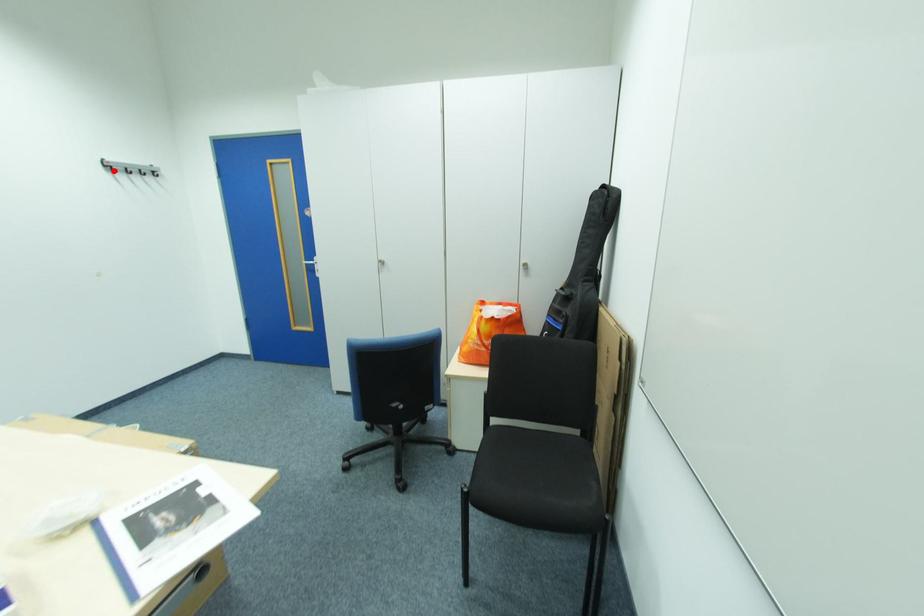
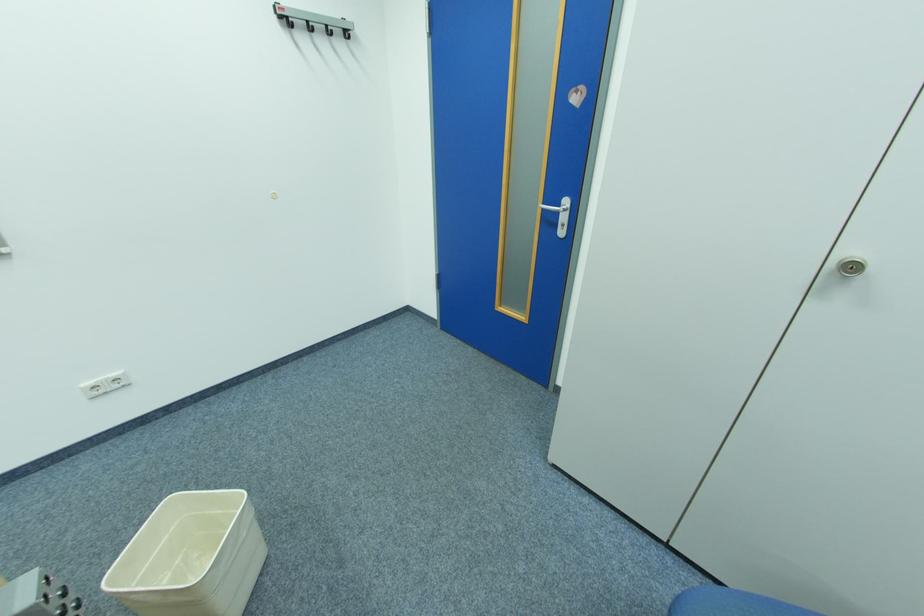
In the second image, find the point that corresponds to the highlighted location in the first image.

(290, 25)